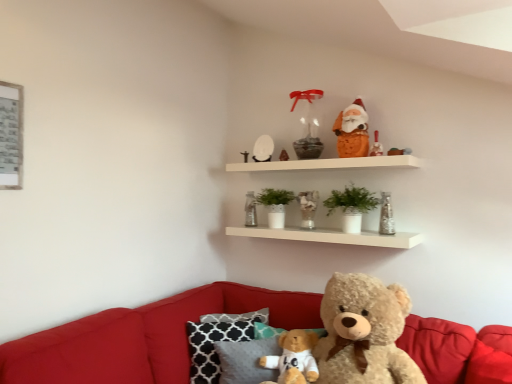
Question: Should I look upward or downward to see translucent glass candle at upper center?

Choices:
 (A) up
 (B) down

Answer: (A)

Question: Can you confirm if translucent glass vase at upper center, which ranks as the 5th toy in left-to-right order, is thinner than green matte plant at center, which is counted as the second plant, starting from the front?

Choices:
 (A) no
 (B) yes

Answer: (B)

Question: Is translucent glass vase at upper center, which ranks as the 5th toy in left-to-right order, behind green matte plant at center, which is counted as the second plant, starting from the front?

Choices:
 (A) yes
 (B) no

Answer: (B)

Question: Is translucent glass vase at upper center, which is counted as the 3th toy, starting from the right, looking in the opposite direction of green matte plant at center, which ranks as the second plant in right-to-left order?

Choices:
 (A) no
 (B) yes

Answer: (A)

Question: Considering the relative sizes of translucent glass vase at upper center, which ranks as the 5th toy in left-to-right order, and green matte plant at center, acting as the 1th plant starting from the left, in the image provided, is translucent glass vase at upper center, which ranks as the 5th toy in left-to-right order, wider than green matte plant at center, acting as the 1th plant starting from the left,?

Choices:
 (A) no
 (B) yes

Answer: (A)

Question: Considering the relative sizes of translucent glass vase at upper center, which is counted as the 3th toy, starting from the right, and green matte plant at center, acting as the 1th plant starting from the back, in the image provided, is translucent glass vase at upper center, which is counted as the 3th toy, starting from the right, bigger than green matte plant at center, acting as the 1th plant starting from the back,?

Choices:
 (A) yes
 (B) no

Answer: (B)

Question: From the image's perspective, would you say translucent glass vase at upper center, which is counted as the 3th toy, starting from the right, is shown under green matte plant at center, acting as the 1th plant starting from the back?

Choices:
 (A) yes
 (B) no

Answer: (A)

Question: From the image's perspective, does metallic silver candlestick at upper center, which is the 7th toy from right to left, appear lower than metallic silver picture frame at upper left?

Choices:
 (A) no
 (B) yes

Answer: (B)

Question: Considering the relative sizes of metallic silver candlestick at upper center, which is the 7th toy from right to left, and metallic silver picture frame at upper left in the image provided, is metallic silver candlestick at upper center, which is the 7th toy from right to left, bigger than metallic silver picture frame at upper left?

Choices:
 (A) yes
 (B) no

Answer: (B)

Question: From a real-world perspective, is metallic silver candlestick at upper center, which is the 7th toy from right to left, located beneath metallic silver picture frame at upper left?

Choices:
 (A) no
 (B) yes

Answer: (A)

Question: Can you confirm if metallic silver candlestick at upper center, acting as the first toy starting from the left, is wider than metallic silver picture frame at upper left?

Choices:
 (A) no
 (B) yes

Answer: (B)

Question: Is metallic silver candlestick at upper center, which is the 7th toy from right to left, facing away from metallic silver picture frame at upper left?

Choices:
 (A) yes
 (B) no

Answer: (B)

Question: Is metallic silver candlestick at upper center, which is the 7th toy from right to left, smaller than metallic silver picture frame at upper left?

Choices:
 (A) no
 (B) yes

Answer: (B)

Question: Considering the relative sizes of white glossy egg at upper center, marked as the fifth toy in a right-to-left arrangement, and metallic silver picture frame at upper left in the image provided, is white glossy egg at upper center, marked as the fifth toy in a right-to-left arrangement, wider than metallic silver picture frame at upper left?

Choices:
 (A) no
 (B) yes

Answer: (B)